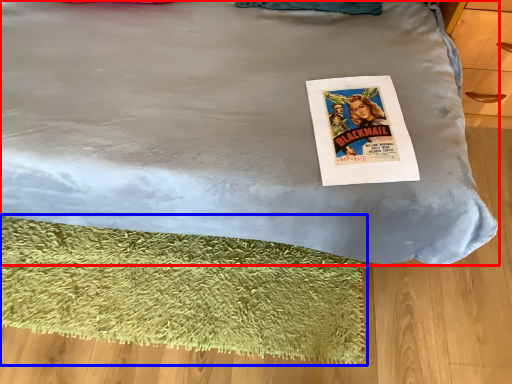
Question: Which object is further to the camera taking this photo, bed (highlighted by a red box) or mat (highlighted by a blue box)?

Choices:
 (A) bed
 (B) mat

Answer: (B)